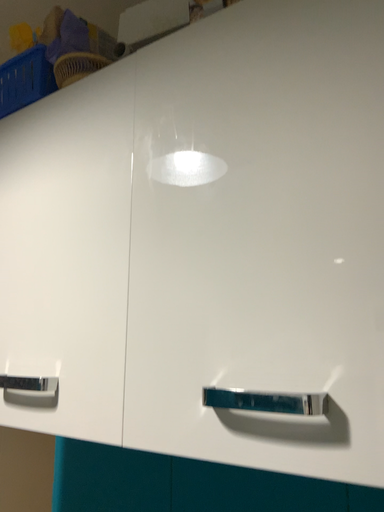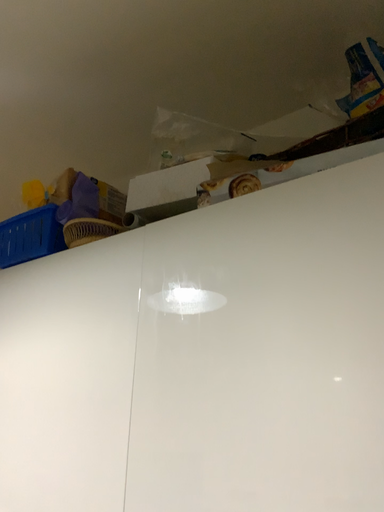
Question: How did the camera likely rotate when shooting the video?

Choices:
 (A) rotated downward
 (B) rotated upward

Answer: (B)